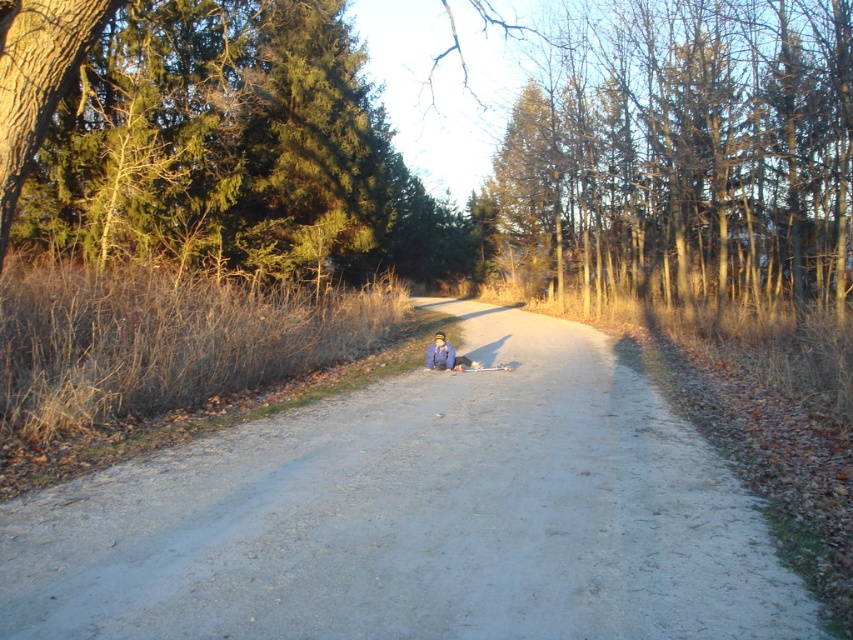
Question: Is gray gravel path at center positioned before blue fabric jacket at center?

Choices:
 (A) no
 (B) yes

Answer: (B)

Question: Is gray gravel path at center further to the viewer compared to blue fabric jacket at center?

Choices:
 (A) yes
 (B) no

Answer: (B)

Question: Which object is closer to the camera taking this photo?

Choices:
 (A) gray gravel path at center
 (B) blue fabric jacket at center

Answer: (A)

Question: Can you confirm if gray gravel path at center is smaller than blue fabric jacket at center?

Choices:
 (A) no
 (B) yes

Answer: (A)

Question: Among these objects, which one is nearest to the camera?

Choices:
 (A) blue fabric jacket at center
 (B) gray gravel path at center

Answer: (B)